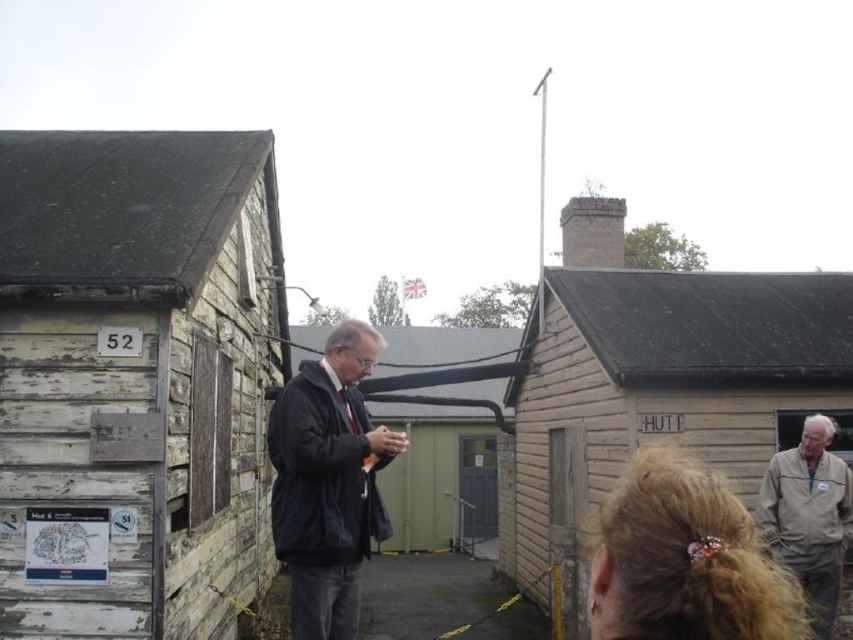
Question: Can you confirm if wooden hut at right is thinner than dark blue fabric jacket at center?

Choices:
 (A) no
 (B) yes

Answer: (B)

Question: Is dark blue fabric jacket at center positioned before brick chimney at upper center?

Choices:
 (A) no
 (B) yes

Answer: (B)

Question: Estimate the real-world distances between objects in this image. Which object is farther from the brick chimney at upper center?

Choices:
 (A) wooden hut at right
 (B) tan fabric jacket at lower right
 (C) dark blue fabric jacket at center
 (D) weathered wood hut at left

Answer: (D)

Question: Which point appears farthest from the camera in this image?

Choices:
 (A) (575, 246)
 (B) (498, 408)

Answer: (A)

Question: Which is nearer to the dark blue jacket at center?

Choices:
 (A) brick chimney at upper center
 (B) tan fabric jacket at lower right

Answer: (B)

Question: Is dark blue jacket at center above dark blue fabric jacket at center?

Choices:
 (A) no
 (B) yes

Answer: (B)